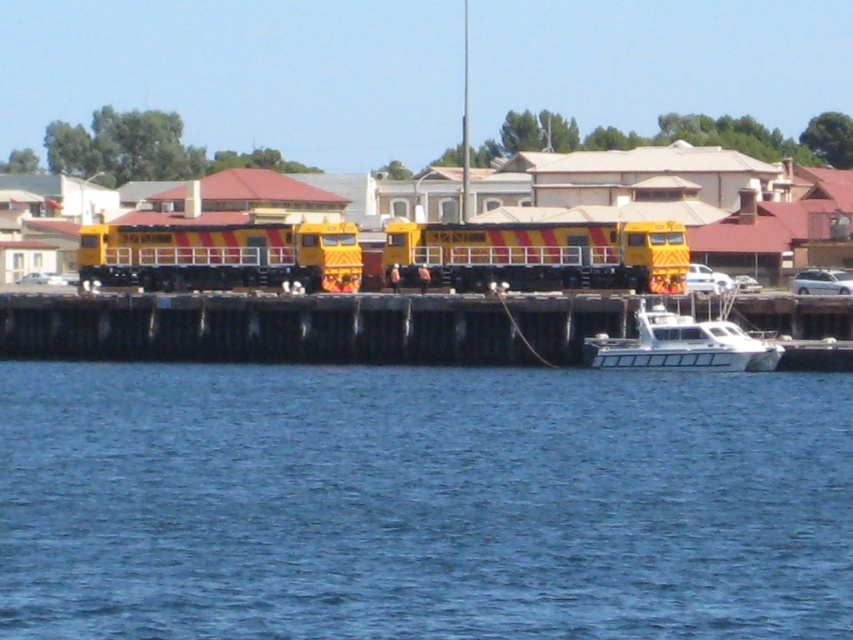
Does wooden dock at center lie in front of yellow painted metal train at center?

Yes, it is.

Measure the distance between wooden dock at center and yellow painted metal train at center.

wooden dock at center and yellow painted metal train at center are 5.22 meters apart from each other.

Between point (799, 314) and point (222, 260), which one is positioned behind?

Point (222, 260)

Locate an element on the screen. This screenshot has width=853, height=640. wooden dock at center is located at coordinates (310, 326).

In the scene shown: Between blue water at lower center and yellow painted metal train at center, which one has more height?

yellow painted metal train at center

Who is more forward, (746, 516) or (561, 250)?

Positioned in front is point (746, 516).

Where is `blue water at lower center`? Image resolution: width=853 pixels, height=640 pixels. blue water at lower center is located at coordinates (421, 502).

Locate an element on the screen. blue water at lower center is located at coordinates (421, 502).

Can you confirm if blue water at lower center is smaller than white glossy boat at lower right?

Actually, blue water at lower center might be larger than white glossy boat at lower right.

Does blue water at lower center come in front of white glossy boat at lower right?

Yes.

Find the location of a particular element. The width and height of the screenshot is (853, 640). blue water at lower center is located at coordinates (421, 502).